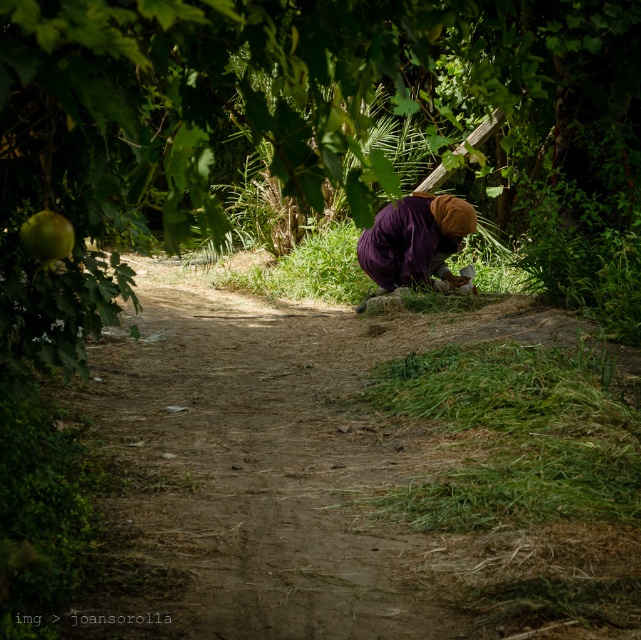
You are a photographer trying to capture both the green leafy tree at center and the purple fabric at center in a single frame. Which object should you focus on first to ensure both are in the shot?

The green leafy tree at center is larger in size than the purple fabric at center, so you should focus on the green leafy tree at center first to ensure both are in the shot.

You are a visitor in this garden and want to take a photo of the purple fabric at center and the green matte apple at upper left. Which object will appear larger in your photo?

The purple fabric at center will appear larger in the photo because it is much taller than the green matte apple at upper left.

You are a painter standing in the middle of the dirt path. You want to paint both the purple fabric at center and the green matte apple at upper left. Which object is wider?

The purple fabric at center is wider than the green matte apple at upper left according to the description.